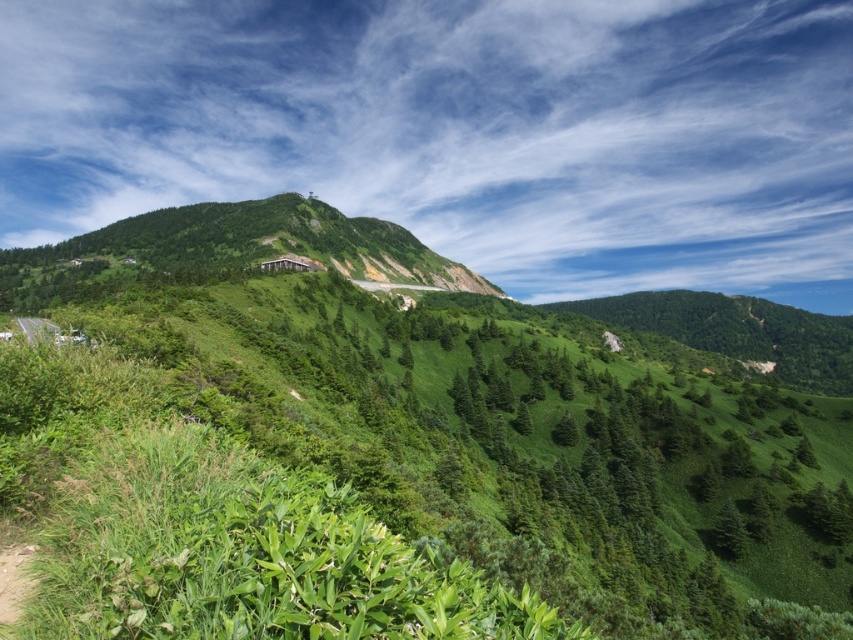
You are a hiker planning to cross the area shown in the image. You need to choose between two paths. One path goes through the green leafy shrubs at center and the other goes around the green grassy hill at center. Which path is wider and thus safer for a group of hikers?

A: The green grassy hill at center is wider than the green leafy shrubs at center, so the path around the green grassy hill at center is wider and safer for a group of hikers.

You are standing in the lush mountain landscape and want to take a photo of both the green leafy shrubs at center and the green grassy hill at center. Which object should you focus on first to ensure both are in sharp focus?

You should focus on the green leafy shrubs at center first because it is closer to the viewer than the green grassy hill at center, so adjusting focus from near to far will help both be in focus.

You are standing at the base of the mountain in the image and want to reach the top. You see two points marked on the path. Which point is closer to you, point (534, 396) or point (35, 296)?

Point (534, 396) is closer to the viewer than point (35, 296), so the point closer to you is point (534, 396).